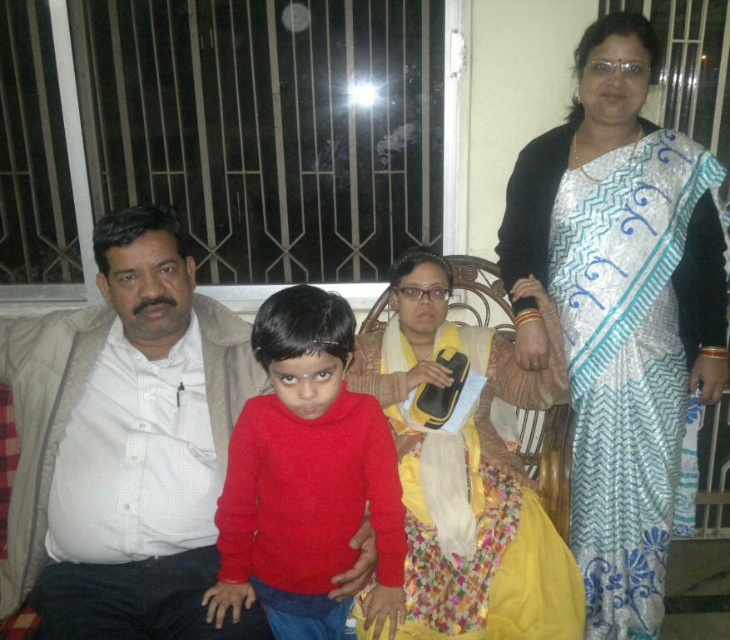
Consider the image. You are a photographer trying to capture a closeup of both the matte red sweater at center and the yellow satin dress at center. Given that your camera can focus on objects within a 30 cm range, can you fit both items in the same frame without moving the camera?

The matte red sweater at center is 29.98 centimeters from the yellow satin dress at center, which is within the camera focus range of 30 cm. Therefore, you can fit both items in the same frame without moving the camera.

You are a photographer who needs to position two subjects in the scene so that the silver metallic saree at upper right is visible to the left of the yellow satin dress at center. Is this possible based on the current arrangement?

No, because the silver metallic saree at upper right is currently to the right of the yellow satin dress at center, so moving it to the left would require changing their positions.